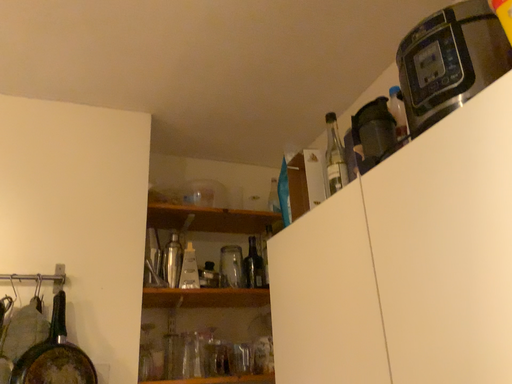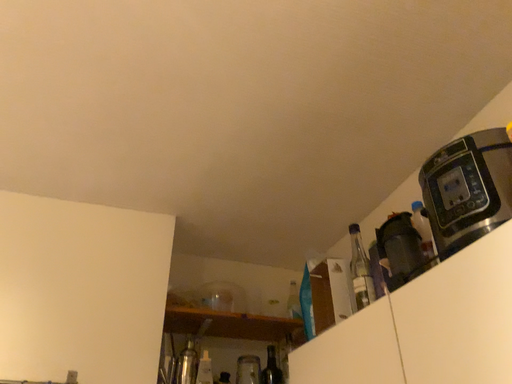
Question: Which way did the camera rotate in the video?

Choices:
 (A) rotated downward
 (B) rotated upward

Answer: (B)